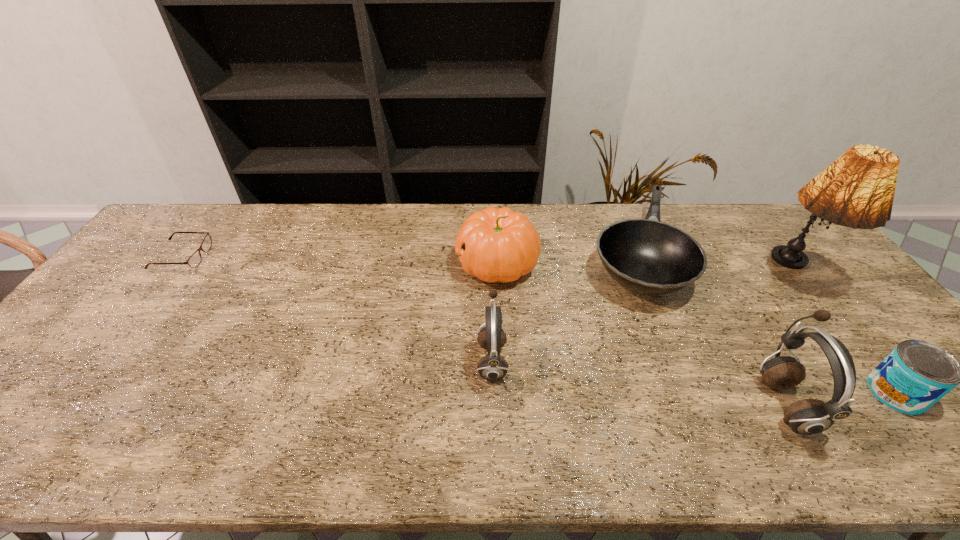
Find the location of a particular element. blank area located on the ear pads of the shorter earphone is located at coordinates (337, 360).

At what (x,y) coordinates should I click in order to perform the action: click on free spot located on the ear pads of the shorter earphone. Please return your answer as a coordinate pair (x, y). Looking at the image, I should click on (357, 360).

The height and width of the screenshot is (540, 960). I want to click on vacant region located on the ear pads of the fifth object from left to right, so click(625, 403).

You are a GUI agent. You are given a task and a screenshot of the screen. Output one action in this format:
    pyautogui.click(x=<x>, y=<y>)
    Task: Click on the vacant space positioned 0.270m on the ear pads of the fifth object from left to right
    This screenshot has width=960, height=540.
    Given the screenshot: What is the action you would take?
    coord(646,403)

Where is `blank space located 0.190m on the ear pads of the fifth object from left to right`? blank space located 0.190m on the ear pads of the fifth object from left to right is located at coordinates (681, 403).

Identify the location of vacant region located 0.240m on the right of the fourth object from left to right. (756, 256).

Where is `vacant space located 0.350m on the lenses of the leftmost object`? This screenshot has width=960, height=540. vacant space located 0.350m on the lenses of the leftmost object is located at coordinates (316, 257).

Locate an element on the screen. vacant position located on the carved face of the pumpkin is located at coordinates (397, 264).

Where is `vacant region located 0.120m on the carved face of the pumpkin`? This screenshot has width=960, height=540. vacant region located 0.120m on the carved face of the pumpkin is located at coordinates (417, 264).

Find the location of `vacant space located on the carved face of the pumpkin`. vacant space located on the carved face of the pumpkin is located at coordinates (385, 264).